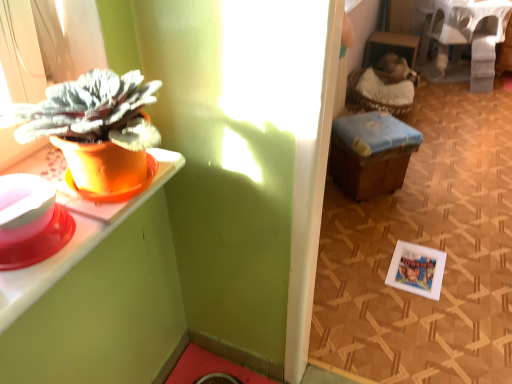
The width and height of the screenshot is (512, 384). I want to click on empty space that is ontop of white matte picture frame at lower right (from a real-world perspective), so click(x=418, y=267).